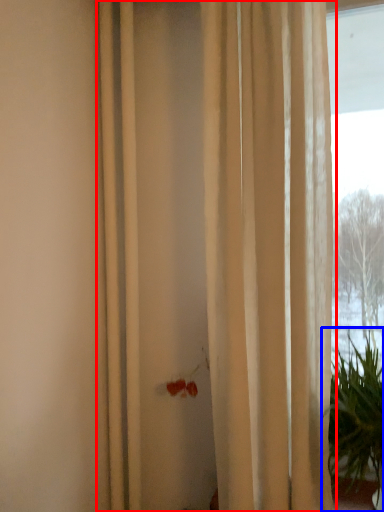
Question: Which object appears closest to the camera in this image, curtain (highlighted by a red box) or houseplant (highlighted by a blue box)?

Choices:
 (A) curtain
 (B) houseplant

Answer: (B)